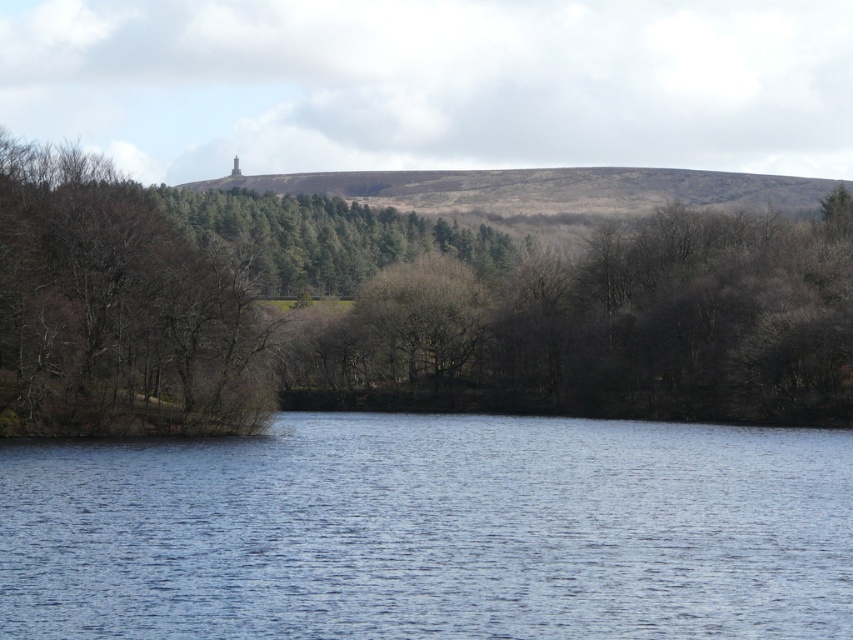
Does blue water at lower center have a lesser width compared to brown/dry grassy hillside at center?

Correct, blue water at lower center's width is less than brown/dry grassy hillside at center's.

Which is in front, point (436, 630) or point (682, 186)?

Positioned in front is point (436, 630).

Where is `blue water at lower center`? The height and width of the screenshot is (640, 853). blue water at lower center is located at coordinates (431, 531).

Is point (308, 243) positioned after point (776, 179)?

No, (308, 243) is in front of (776, 179).

What are the coordinates of `brown leafless tree at center` in the screenshot? It's located at (398, 308).

Locate an element on the screen. This screenshot has height=640, width=853. brown leafless tree at center is located at coordinates (398, 308).

Can you confirm if brown leafless tree at center is wider than blue water at lower center?

Indeed, brown leafless tree at center has a greater width compared to blue water at lower center.

Image resolution: width=853 pixels, height=640 pixels. Find the location of `brown leafless tree at center`. brown leafless tree at center is located at coordinates (398, 308).

This screenshot has width=853, height=640. In order to click on brown leafless tree at center in this screenshot , I will do `click(398, 308)`.